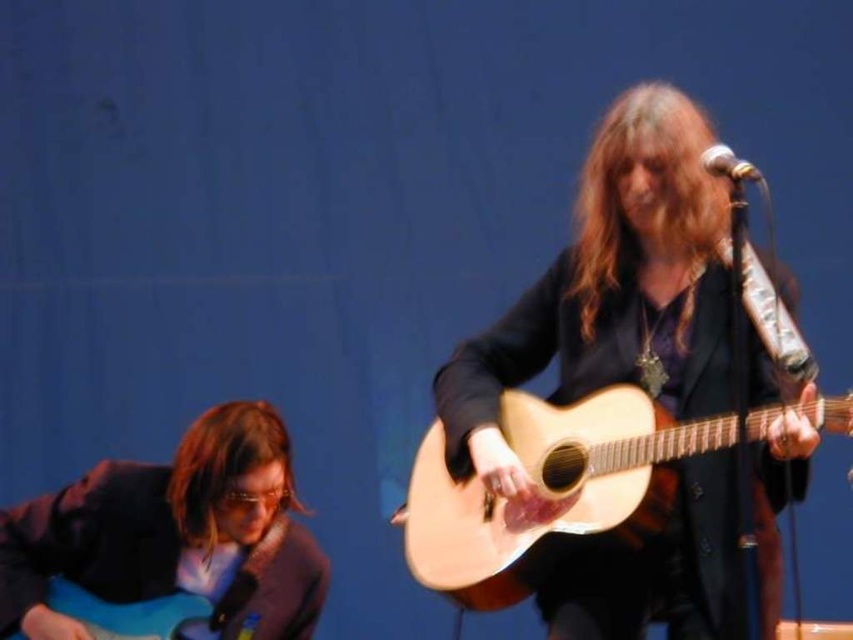
Can you confirm if natural wood guitar at center is bigger than natural wood acoustic guitar at center?

Yes.

Is natural wood guitar at center closer to camera compared to natural wood acoustic guitar at center?

No, natural wood guitar at center is further to the viewer.

This screenshot has height=640, width=853. I want to click on natural wood guitar at center, so coord(612,291).

Locate an element on the screen. The width and height of the screenshot is (853, 640). natural wood guitar at center is located at coordinates coord(612,291).

Does natural wood acoustic guitar at center have a greater width compared to blue glossy electric guitar at lower left?

Indeed, natural wood acoustic guitar at center has a greater width compared to blue glossy electric guitar at lower left.

Measure the distance between natural wood acoustic guitar at center and blue glossy electric guitar at lower left.

76.05 centimeters

Is point (428, 486) farther from viewer compared to point (166, 627)?

No, it is in front of (166, 627).

At what (x,y) coordinates should I click in order to perform the action: click on natural wood acoustic guitar at center. Please return your answer as a coordinate pair (x, y). Looking at the image, I should click on (547, 490).

Does natural wood guitar at center have a greater width compared to matte black guitar at left?

Yes, natural wood guitar at center is wider than matte black guitar at left.

Is natural wood guitar at center to the right of matte black guitar at left from the viewer's perspective?

Correct, you'll find natural wood guitar at center to the right of matte black guitar at left.

Does point (701, 522) come in front of point (163, 582)?

That is True.

You are a GUI agent. You are given a task and a screenshot of the screen. Output one action in this format:
    pyautogui.click(x=<x>, y=<y>)
    Task: Click on the natural wood guitar at center
    The height and width of the screenshot is (640, 853).
    Given the screenshot: What is the action you would take?
    pyautogui.click(x=612, y=291)